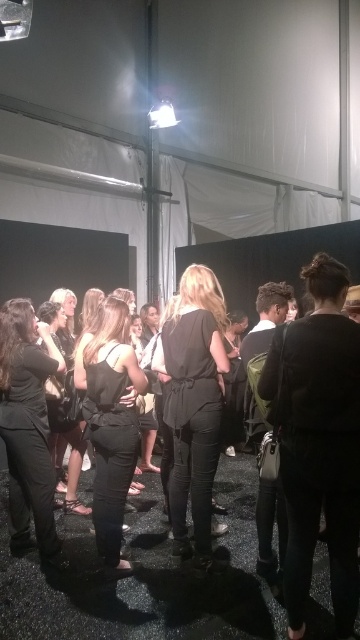
Does matte black blouse at center have a greater height compared to black matte dress at center?

Correct, matte black blouse at center is much taller as black matte dress at center.

Is point (205, 374) positioned after point (110, 467)?

Yes, it is.

The width and height of the screenshot is (360, 640). In order to click on matte black blouse at center in this screenshot , I will do `click(194, 403)`.

How much distance is there between matte black blouse at center and matte black top at center?

30.99 inches

Does matte black blouse at center have a greater width compared to matte black top at center?

Correct, the width of matte black blouse at center exceeds that of matte black top at center.

Find the location of a particular element. matte black blouse at center is located at coordinates click(x=194, y=403).

Does matte black top at center have a greater width compared to black matte dress at center?

No, matte black top at center is not wider than black matte dress at center.

Can you confirm if matte black top at center is positioned to the left of black matte dress at center?

Indeed, matte black top at center is positioned on the left side of black matte dress at center.

Which is behind, point (15, 300) or point (127, 426)?

The point (15, 300) is behind.

Locate an element on the screen. This screenshot has height=640, width=360. matte black top at center is located at coordinates (28, 426).